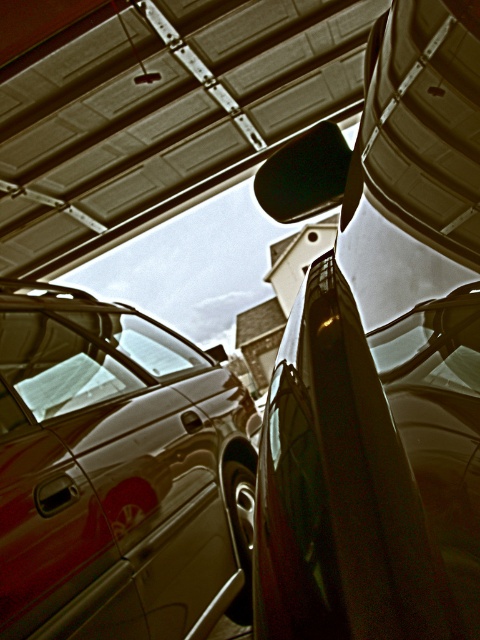
Consider the image. Is glossy metallic car at upper right taller than shiny metallic van at lower left?

No.

You are a GUI agent. You are given a task and a screenshot of the screen. Output one action in this format:
    pyautogui.click(x=<x>, y=<y>)
    Task: Click on the glossy metallic car at upper right
    The height and width of the screenshot is (640, 480).
    Given the screenshot: What is the action you would take?
    [381, 355]

Who is more forward, [443,330] or [240,593]?

Point [443,330]

You are a GUI agent. You are given a task and a screenshot of the screen. Output one action in this format:
    pyautogui.click(x=<x>, y=<y>)
    Task: Click on the glossy metallic car at upper right
    The image size is (480, 640).
    Given the screenshot: What is the action you would take?
    pyautogui.click(x=381, y=355)